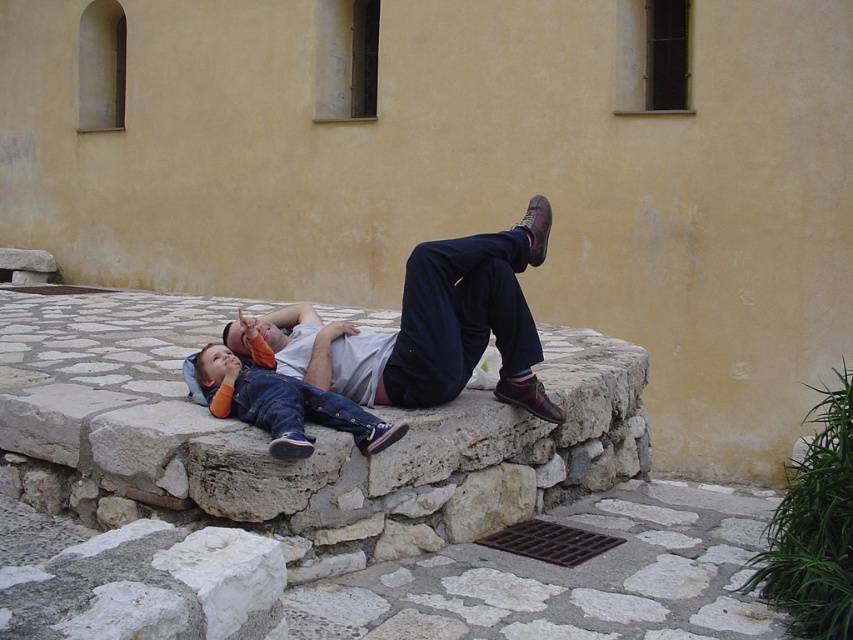
You are taking a photo of the two people on the stone bench. You want to focus on the person closer to the camera. Which point should you focus on, point (430, 368) or point (253, 410)?

Point (430, 368) is further to the camera than point (253, 410), so you should focus on point (430, 368) to capture the person closer to the camera.